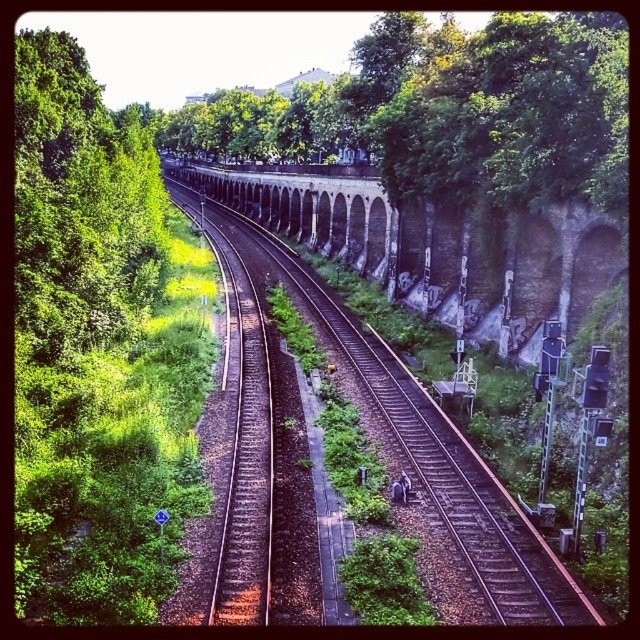
Question: Which object is positioned farthest from the green leafy tree at center?

Choices:
 (A) brown gravel train track at center
 (B) green leafy tree at left

Answer: (A)

Question: Can you confirm if green leafy tree at center is positioned to the right of brown gravel train track at center?

Choices:
 (A) yes
 (B) no

Answer: (B)

Question: Which point is closer to the camera taking this photo?

Choices:
 (A) (259, 403)
 (B) (147, 518)

Answer: (B)

Question: Where is green leafy tree at center located in relation to brown gravel train track at center in the image?

Choices:
 (A) left
 (B) right

Answer: (A)

Question: Which point is farther to the camera?

Choices:
 (A) green leafy tree at center
 (B) brown gravel train track at center
 (C) green leafy tree at left

Answer: (A)

Question: Is green leafy tree at left bigger than green leafy tree at center?

Choices:
 (A) no
 (B) yes

Answer: (A)